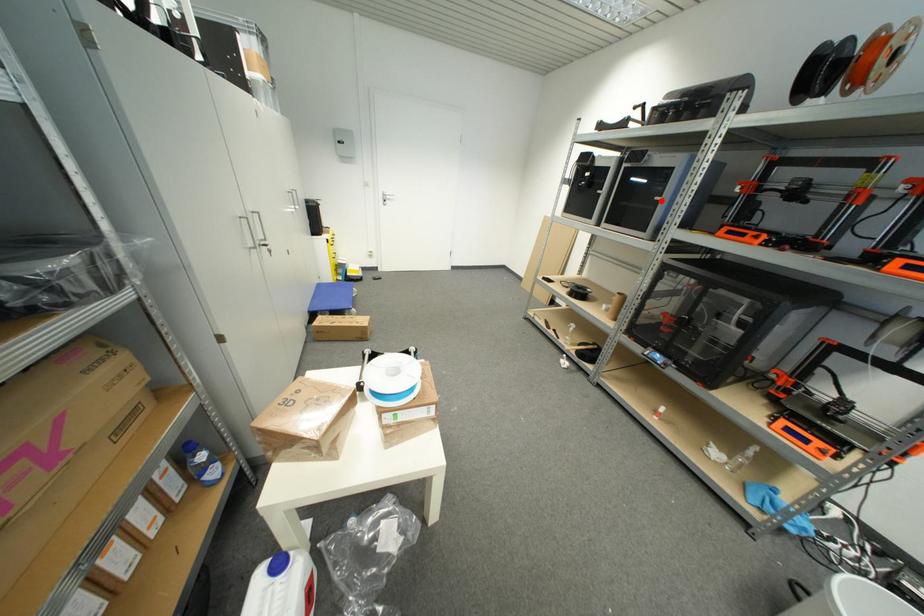
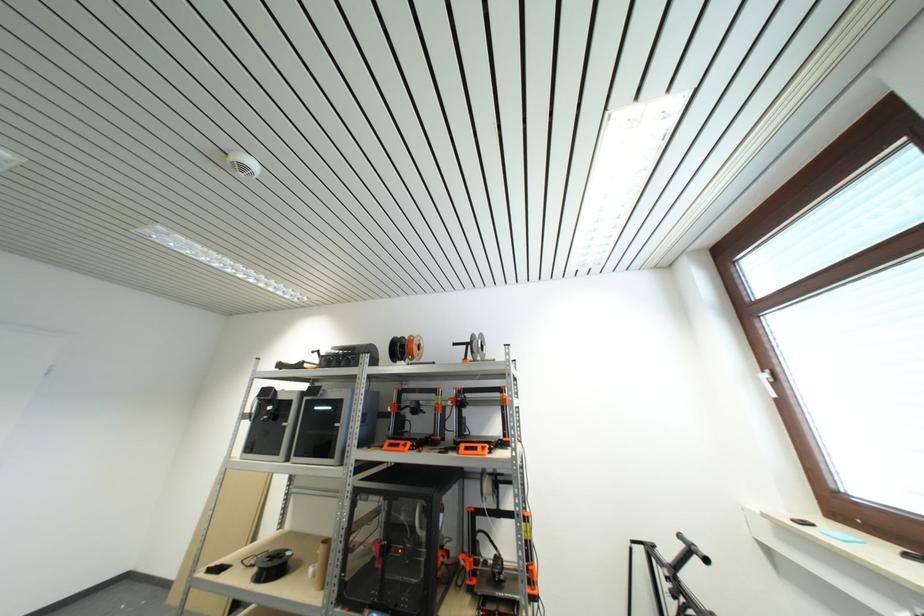
In the second image, find the point that corresponds to the highlighted location in the first image.

(341, 427)